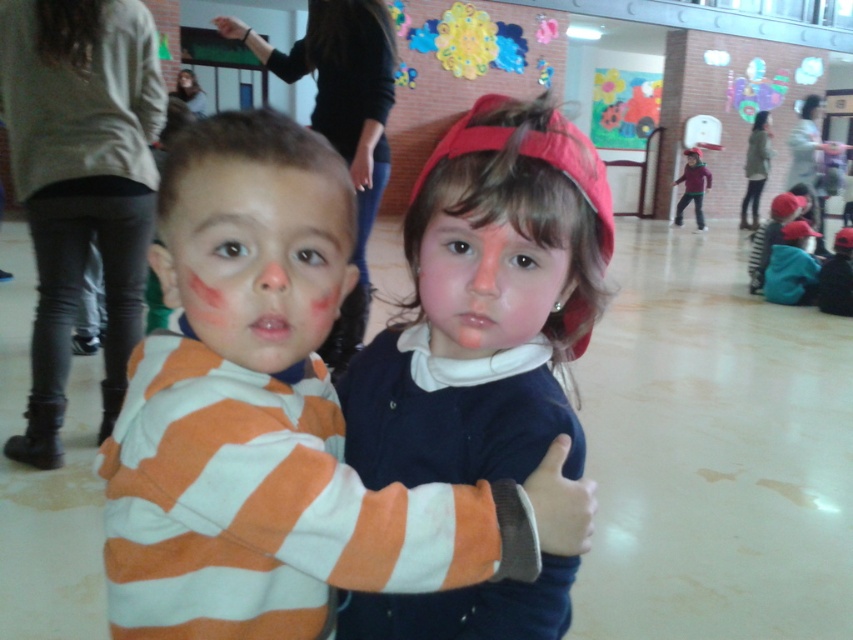
Can you confirm if orange striped sweater at center is positioned below matte purple sweater at center?

Yes.

Image resolution: width=853 pixels, height=640 pixels. Describe the element at coordinates (273, 420) in the screenshot. I see `orange striped sweater at center` at that location.

Identify the location of orange striped sweater at center. The width and height of the screenshot is (853, 640). (273, 420).

Does matte orange striped shirt at center have a smaller size compared to smooth skin face at center?

No.

Can you confirm if matte orange striped shirt at center is thinner than smooth skin face at center?

No.

Between point (326, 300) and point (438, 230), which one is positioned behind?

The point (438, 230) is behind.

Find the location of a particular element. The width and height of the screenshot is (853, 640). matte orange striped shirt at center is located at coordinates (257, 259).

Between point (199, 381) and point (407, 237), which one is positioned in front?

Point (199, 381) is more forward.

Measure the distance between orange striped sweater at center and camera.

A distance of 49.47 centimeters exists between orange striped sweater at center and camera.

In the scene shown: Who is more distant from viewer, [245,445] or [485,342]?

Positioned behind is point [485,342].

Image resolution: width=853 pixels, height=640 pixels. I want to click on orange striped sweater at center, so click(273, 420).